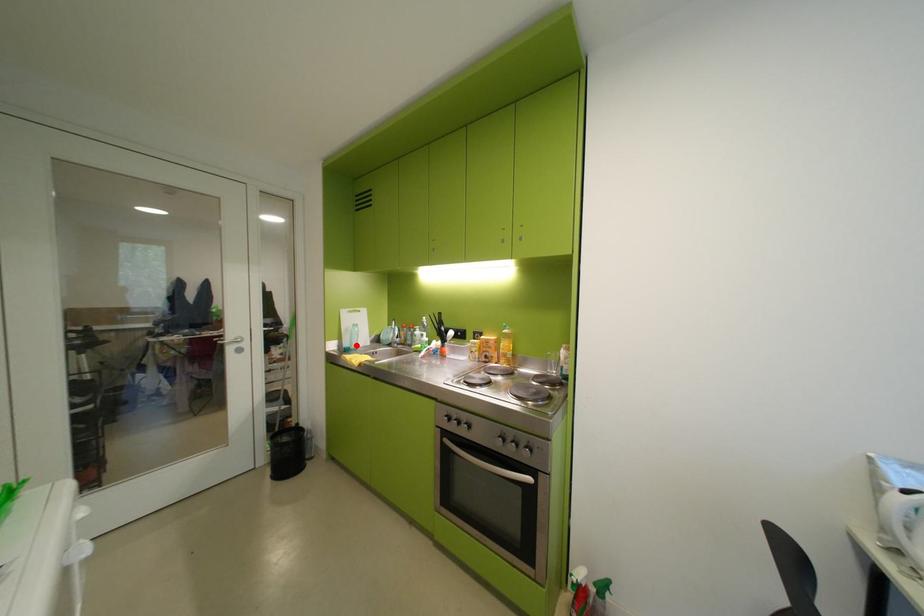
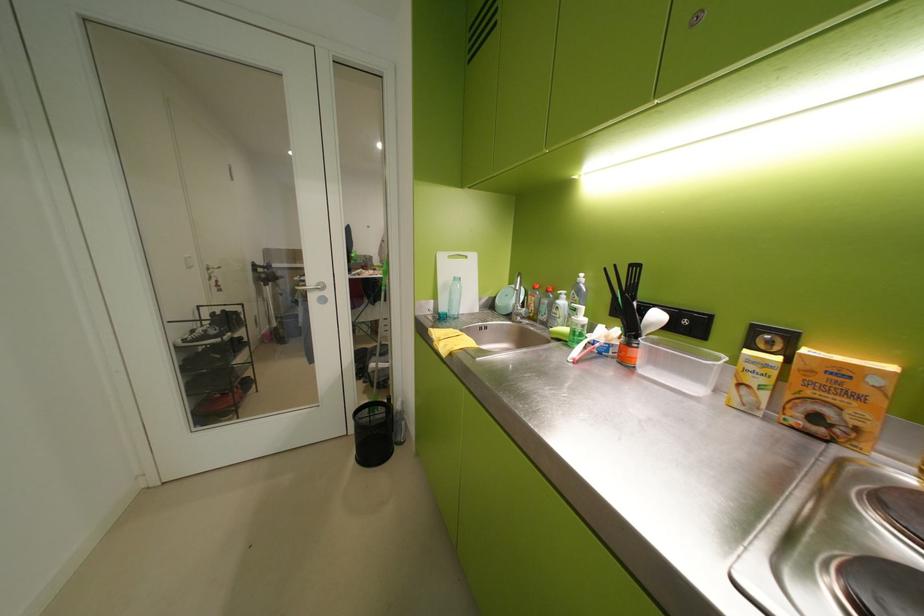
Find the pixel in the second image that matches the highlighted location in the first image.

(453, 310)